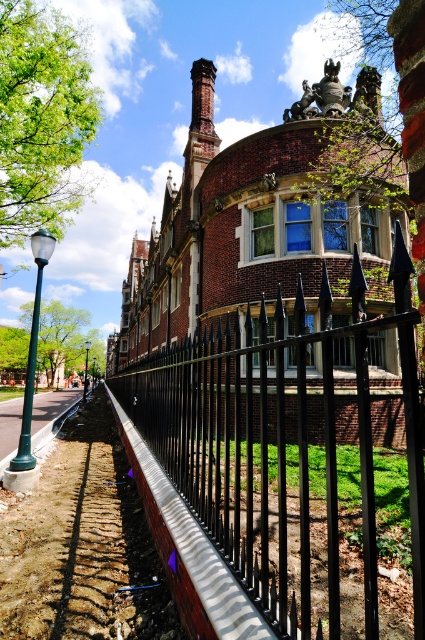
You are standing in front of the historic building and want to take a photo of the black wrought iron fence at center and the green leafy tree at left. Which object is closer to the camera?

The black wrought iron fence at center is closer to the camera because it is positioned over the green leafy tree at left, meaning it is in front of the tree.